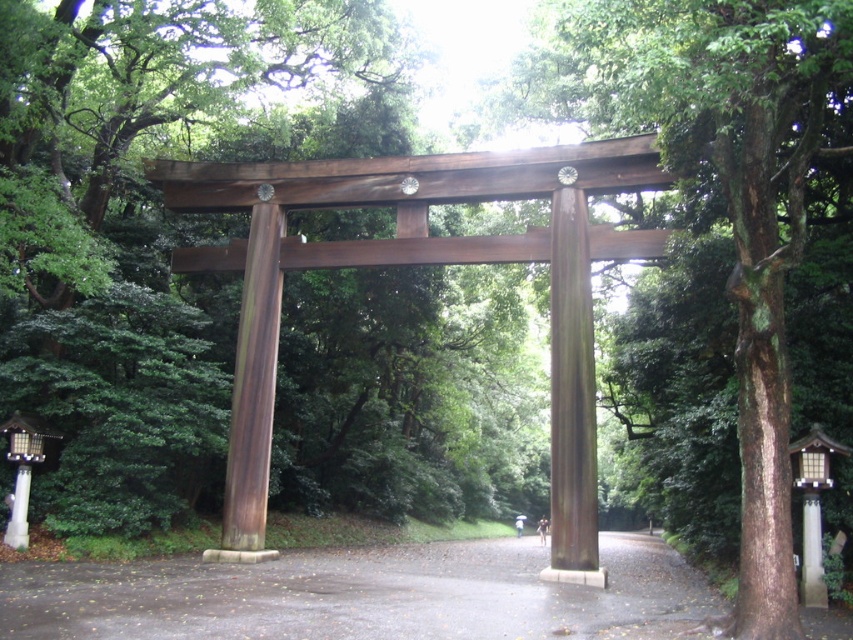
Question: Among these points, which one is farthest from the camera?

Choices:
 (A) (717, 42)
 (B) (466, 627)
 (C) (560, 538)

Answer: (C)

Question: Can you confirm if green mossy bark tree at center is positioned to the left of brown polished wood at center?

Choices:
 (A) yes
 (B) no

Answer: (B)

Question: Which object is farther from the camera taking this photo?

Choices:
 (A) brown wood torii gate at center
 (B) green mossy bark tree at center
 (C) brown polished wood at center
 (D) glossy asphalt path at center

Answer: (C)

Question: Does green mossy bark tree at center lie behind brown polished wood at center?

Choices:
 (A) yes
 (B) no

Answer: (B)

Question: Which object appears farthest from the camera in this image?

Choices:
 (A) brown polished wood at center
 (B) green mossy bark tree at center
 (C) brown wood torii gate at center

Answer: (A)

Question: Does brown polished wood post at center appear on the right side of brown polished wood at center?

Choices:
 (A) no
 (B) yes

Answer: (B)